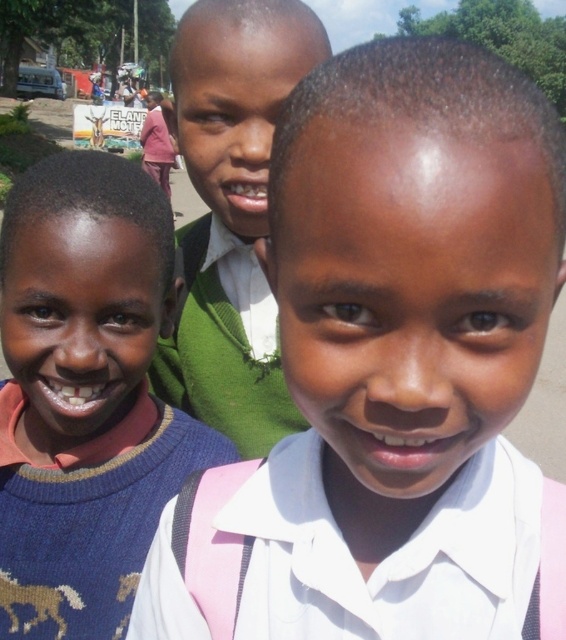
Does blue knitted sweater at left appear on the left side of green sweater at center?

Indeed, blue knitted sweater at left is positioned on the left side of green sweater at center.

The width and height of the screenshot is (566, 640). Describe the element at coordinates (84, 396) in the screenshot. I see `blue knitted sweater at left` at that location.

I want to click on blue knitted sweater at left, so click(84, 396).

Is pink fabric at center bigger than blue knitted sweater at left?

Correct, pink fabric at center is larger in size than blue knitted sweater at left.

Is pink fabric at center positioned before blue knitted sweater at left?

That is True.

Who is more forward, (258, 586) or (28, 200)?

Point (258, 586) is more forward.

Where is `pink fabric at center`? The image size is (566, 640). pink fabric at center is located at coordinates (393, 365).

Measure the distance between point (x=379, y=234) and camera.

A distance of 16.79 inches exists between point (x=379, y=234) and camera.

Based on the photo, is pink fabric at center to the right of green sweater at center from the viewer's perspective?

Indeed, pink fabric at center is positioned on the right side of green sweater at center.

Is point (469, 348) farther from camera compared to point (233, 378)?

No, (469, 348) is closer to viewer.

You are a GUI agent. You are given a task and a screenshot of the screen. Output one action in this format:
    pyautogui.click(x=<x>, y=<y>)
    Task: Click on the pink fabric at center
    This screenshot has height=640, width=566.
    Given the screenshot: What is the action you would take?
    pyautogui.click(x=393, y=365)